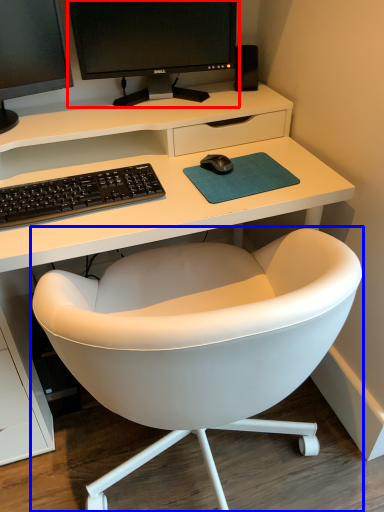
Question: Among these objects, which one is farthest to the camera, computer monitor (highlighted by a red box) or chair (highlighted by a blue box)?

Choices:
 (A) computer monitor
 (B) chair

Answer: (A)